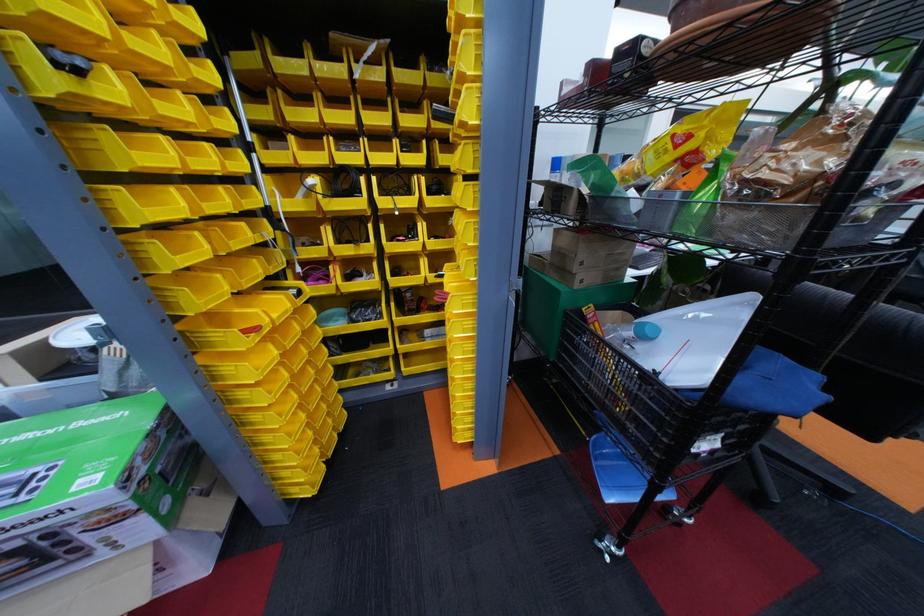
Find the location of a particular element. blue plastic cup is located at coordinates (646, 330).